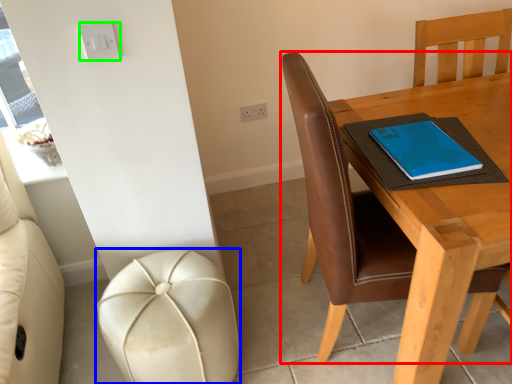
Question: Which is nearer to the chair (highlighted by a red box)? stool (highlighted by a blue box) or light switch (highlighted by a green box).

Choices:
 (A) stool
 (B) light switch

Answer: (A)